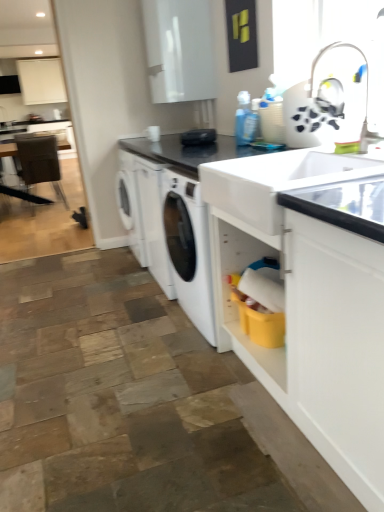
Question: Which direction should I rotate to look at black granite countertop at center, arranged as the first countertop when viewed from the top, — up or down?

Choices:
 (A) down
 (B) up

Answer: (B)

Question: Could you tell me if white matte cabinet at upper left, arranged as the 1th cabinetry when viewed from the back, is turned towards white glossy sink at center?

Choices:
 (A) yes
 (B) no

Answer: (A)

Question: From the image's perspective, is white matte cabinet at upper left, placed as the first cabinetry when sorted from left to right, under white glossy sink at center?

Choices:
 (A) yes
 (B) no

Answer: (B)

Question: Considering the relative sizes of white matte cabinet at upper left, the 2th cabinetry in the front-to-back sequence, and white glossy sink at center in the image provided, is white matte cabinet at upper left, the 2th cabinetry in the front-to-back sequence, taller than white glossy sink at center?

Choices:
 (A) yes
 (B) no

Answer: (A)

Question: Considering the relative sizes of white matte cabinet at upper left, acting as the 1th cabinetry starting from the top, and white glossy sink at center in the image provided, is white matte cabinet at upper left, acting as the 1th cabinetry starting from the top, wider than white glossy sink at center?

Choices:
 (A) no
 (B) yes

Answer: (A)

Question: From the image's perspective, is white matte cabinet at upper left, the 2th cabinetry in the front-to-back sequence, on top of white glossy sink at center?

Choices:
 (A) no
 (B) yes

Answer: (B)

Question: Could white glossy sink at center be considered to be inside white matte cabinet at upper left, which is the 2th cabinetry in bottom-to-top order?

Choices:
 (A) yes
 (B) no

Answer: (B)

Question: Considering the relative sizes of brown leather chair at left and black granite countertop at center, arranged as the first countertop when viewed from the top, in the image provided, is brown leather chair at left taller than black granite countertop at center, arranged as the first countertop when viewed from the top,?

Choices:
 (A) yes
 (B) no

Answer: (A)

Question: Is brown leather chair at left to the right of black granite countertop at center, arranged as the first countertop when viewed from the top, from the viewer's perspective?

Choices:
 (A) yes
 (B) no

Answer: (B)

Question: From the image's perspective, would you say brown leather chair at left is positioned over black granite countertop at center, acting as the second countertop starting from the bottom?

Choices:
 (A) yes
 (B) no

Answer: (A)

Question: Can you confirm if brown leather chair at left is positioned to the left of black granite countertop at center, arranged as the first countertop when viewed from the top?

Choices:
 (A) no
 (B) yes

Answer: (B)

Question: Is brown leather chair at left bigger than black granite countertop at center, arranged as the first countertop when viewed from the top?

Choices:
 (A) no
 (B) yes

Answer: (B)

Question: From a real-world perspective, is brown leather chair at left under black granite countertop at center, acting as the second countertop starting from the bottom?

Choices:
 (A) no
 (B) yes

Answer: (B)

Question: Does white glossy sink at center come behind brown leather chair at left?

Choices:
 (A) yes
 (B) no

Answer: (B)